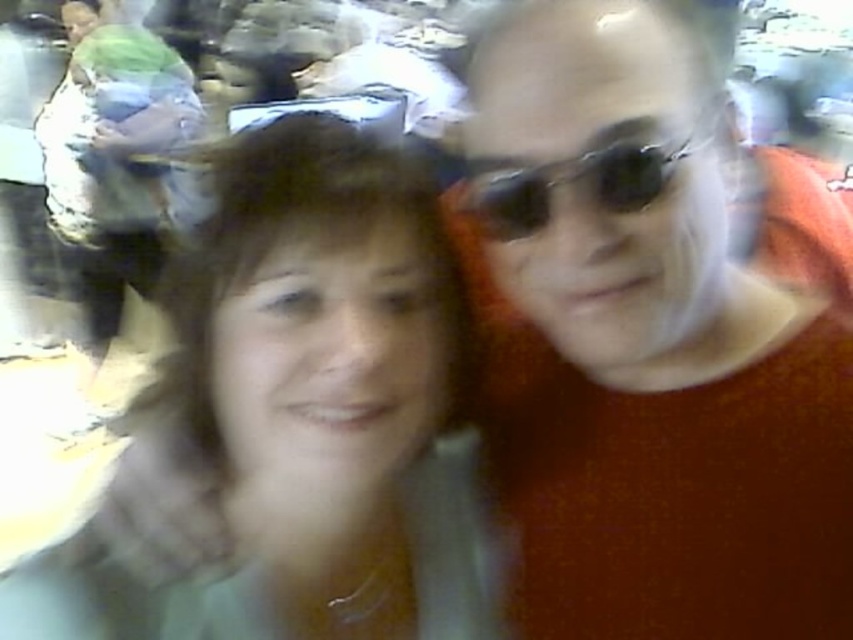
You are holding a camera and want to adjust your focus to capture the orange matte sweater at right and the sunglasses at center clearly. Based on their positions, which object should you focus on first to ensure both are in focus?

→ The orange matte sweater at right is in front of sunglasses at center, so you should focus on the orange matte sweater at right first to ensure both are in focus.

You are trying to locate the orange matte sweater at right in the image. According to the coordinates provided, where exactly is it positioned?

The orange matte sweater at right is located at point 0.522 on the x axis and 0.768 on the y axis.